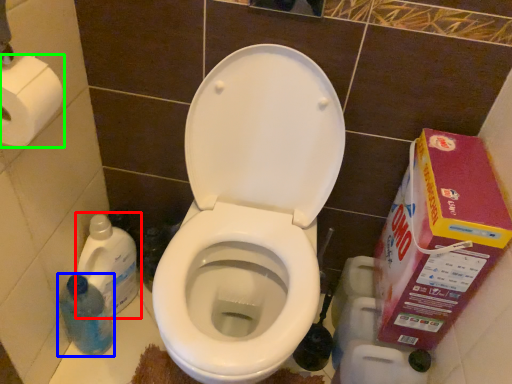
Question: Which object is the closest to the cleaning product (highlighted by a red box)? Choose among these: cleaning product (highlighted by a blue box) or toilet paper (highlighted by a green box).

Choices:
 (A) cleaning product
 (B) toilet paper

Answer: (A)